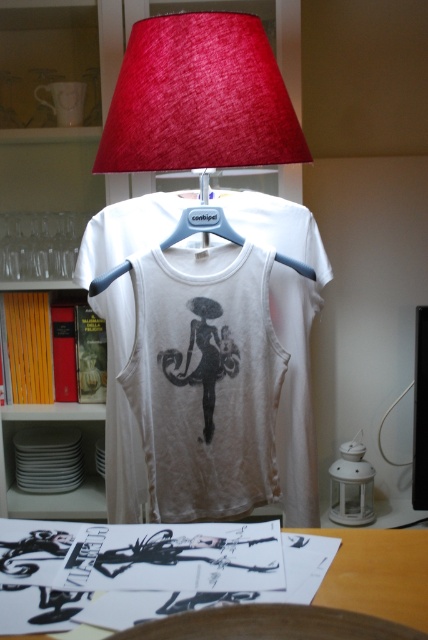
Between textured red lampshade at upper center and wooden table at lower center, which one is positioned higher?

Positioned higher is textured red lampshade at upper center.

Is textured red lampshade at upper center below wooden table at lower center?

Incorrect, textured red lampshade at upper center is not positioned below wooden table at lower center.

Where is `textured red lampshade at upper center`? textured red lampshade at upper center is located at coordinates (199, 99).

Between white cotton tank top at center and wooden table at lower center, which one appears on the right side from the viewer's perspective?

From the viewer's perspective, wooden table at lower center appears more on the right side.

Between white cotton tank top at center and wooden table at lower center, which one has more height?

Standing taller between the two is white cotton tank top at center.

This screenshot has width=428, height=640. Identify the location of white cotton tank top at center. (205, 387).

Which is above, white matte lantern at lower right or blue plastic hanger at center?

Positioned higher is blue plastic hanger at center.

Which is in front, point (350, 509) or point (312, 273)?

Point (312, 273) is more forward.

Is point (356, 490) behind point (202, 228)?

Yes, point (356, 490) is behind point (202, 228).

This screenshot has width=428, height=640. Find the location of `white matte lantern at lower right`. white matte lantern at lower right is located at coordinates (351, 486).